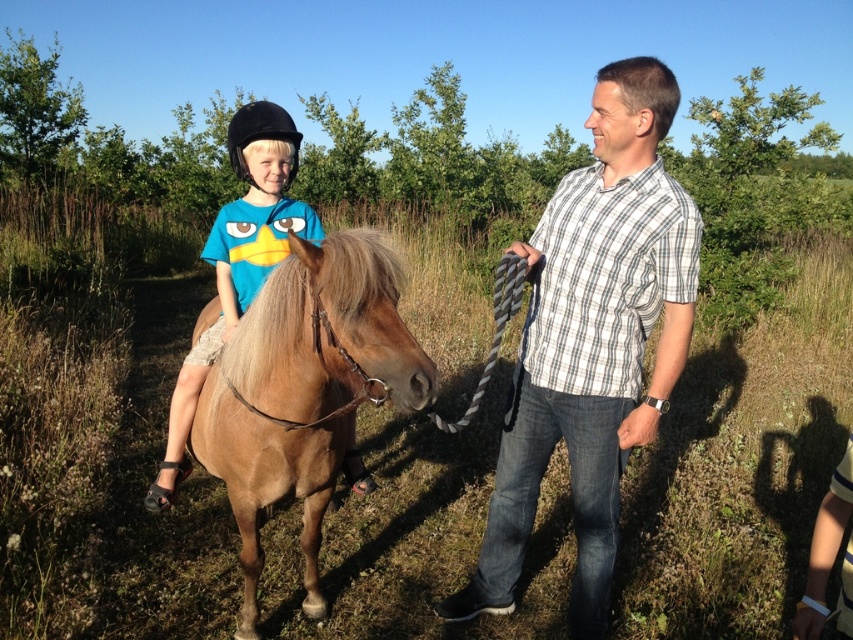
Between point (589, 541) and point (262, 120), which one is positioned behind?

The point (262, 120) is behind.

Describe the element at coordinates (592, 340) in the screenshot. I see `white checkered shirt at center` at that location.

Is point (683, 195) positioned before point (206, 371)?

Yes.

Identify the location of white checkered shirt at center. (592, 340).

Measure the distance between point (650, 250) and camera.

Point (650, 250) is 2.36 meters away from camera.

Between white checkered shirt at center and light brown glossy horse at center, which one has less height?

With less height is light brown glossy horse at center.

Locate an element on the screen. white checkered shirt at center is located at coordinates (592, 340).

Between light brown glossy horse at center and matte black helmet at upper left, which one appears on the right side from the viewer's perspective?

Positioned to the right is light brown glossy horse at center.

Between point (370, 352) and point (193, 392), which one is positioned in front?

Point (370, 352) is more forward.

Does point (294, 310) come farther from viewer compared to point (309, 230)?

No.

Find the location of a particular element. This screenshot has width=853, height=640. light brown glossy horse at center is located at coordinates (305, 390).